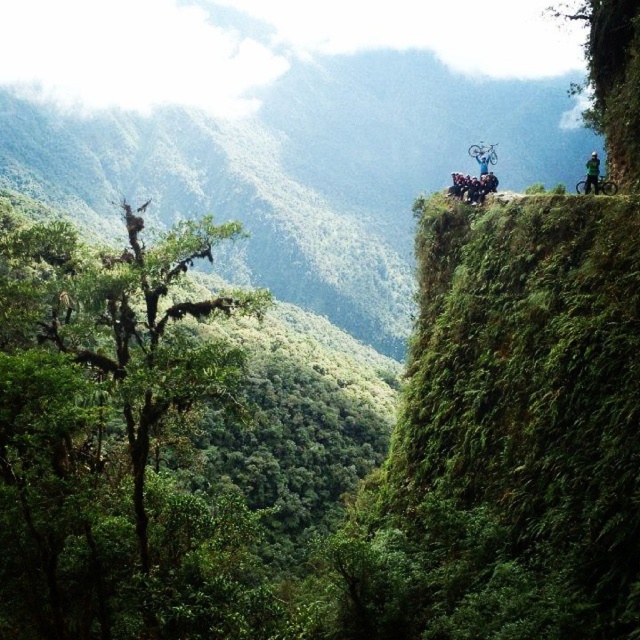
Question: Which object is farther from the camera taking this photo?

Choices:
 (A) green leafy tree at left
 (B) green matte bicycle at upper right
 (C) blue metallic mountain bike at upper right

Answer: (C)

Question: Does green matte bicycle at upper right have a smaller size compared to blue metallic mountain bike at upper right?

Choices:
 (A) yes
 (B) no

Answer: (A)

Question: Which object is farther from the camera taking this photo?

Choices:
 (A) blue metallic mountain bike at upper right
 (B) green matte mountain bike at upper right
 (C) green matte bicycle at upper right
 (D) green matte helmet at upper right

Answer: (A)

Question: Does green leafy mountain at upper right appear on the left side of blue metallic mountain bike at upper right?

Choices:
 (A) no
 (B) yes

Answer: (B)

Question: Is green matte bicycle at upper right thinner than green matte helmet at upper right?

Choices:
 (A) yes
 (B) no

Answer: (B)

Question: Which of the following is the closest to the observer?

Choices:
 (A) (484, 168)
 (B) (81, 388)

Answer: (B)